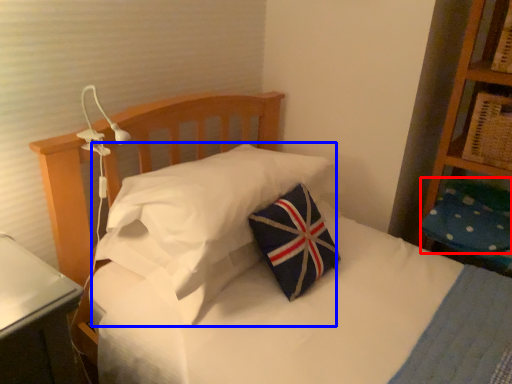
Question: Which of the following is the farthest to the observer, pillow (highlighted by a red box) or pillow (highlighted by a blue box)?

Choices:
 (A) pillow
 (B) pillow

Answer: (A)